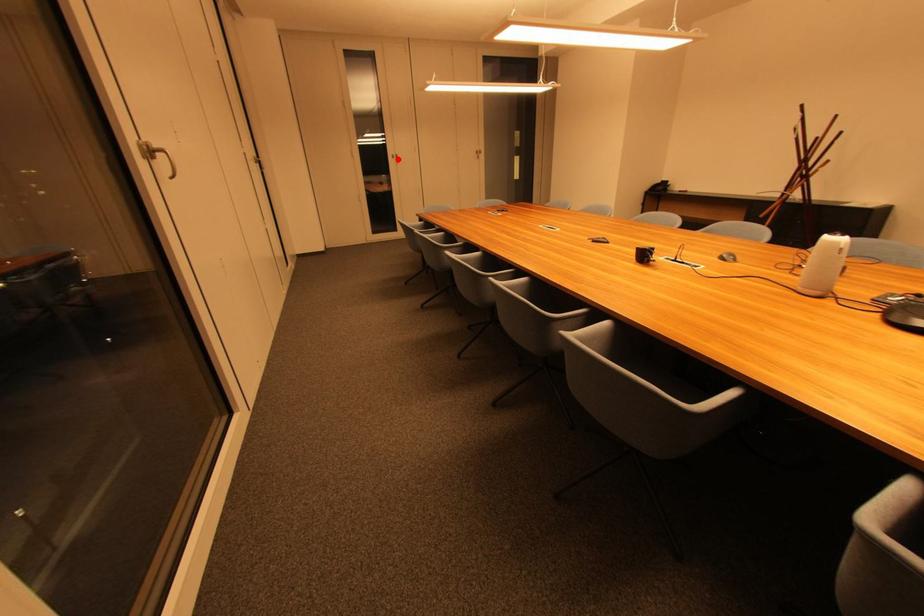
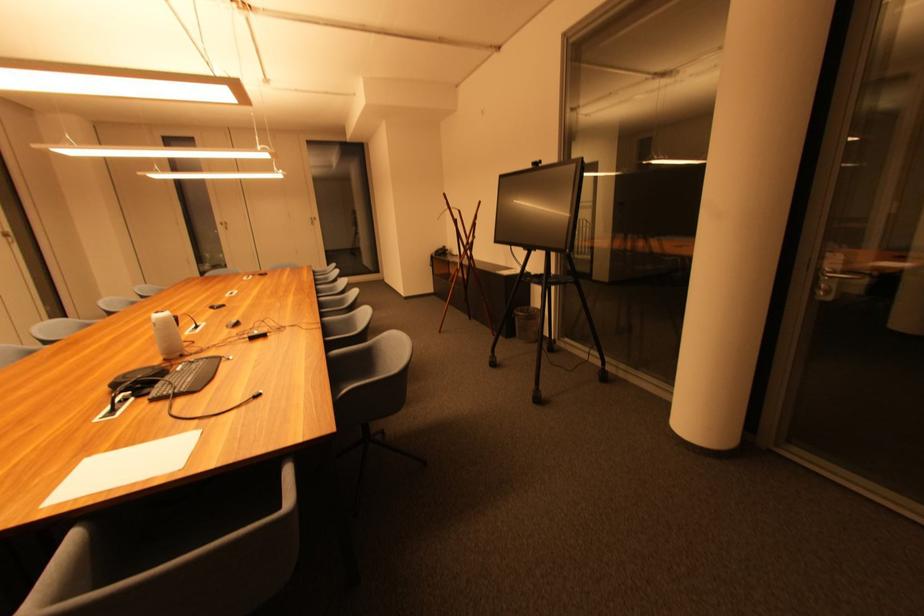
Find the pixel in the second image that matches the highlighted location in the first image.

(226, 225)